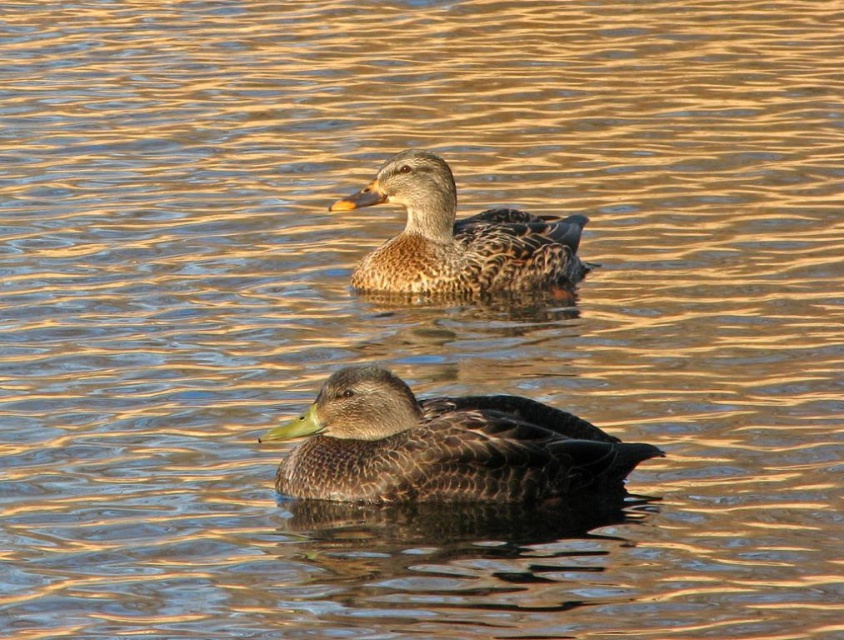
Which of these two, dark brown feathers at center or brown matte duck at upper center, stands shorter?

With less height is dark brown feathers at center.

Can you confirm if dark brown feathers at center is bigger than brown matte duck at upper center?

Actually, dark brown feathers at center might be smaller than brown matte duck at upper center.

Identify the location of dark brown feathers at center. Image resolution: width=844 pixels, height=640 pixels. click(441, 445).